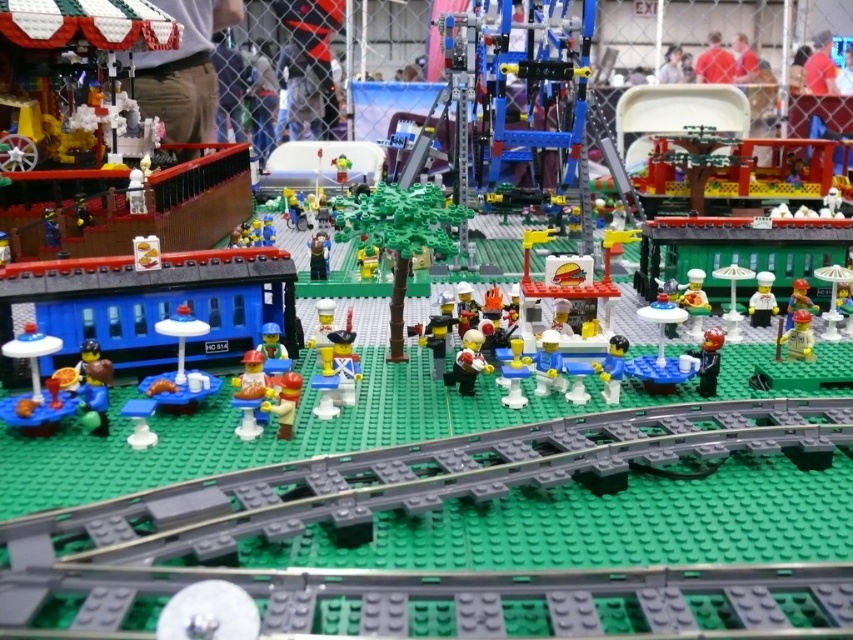
Can you confirm if white plastic table at center-left is thinner than yellow matte minifigure at right?

No, white plastic table at center-left is not thinner than yellow matte minifigure at right.

The width and height of the screenshot is (853, 640). In order to click on white plastic table at center-left in this screenshot , I will do pos(180,368).

This screenshot has width=853, height=640. I want to click on white plastic table at center-left, so click(x=180, y=368).

Who is lower down, white glossy chef hat at center or smooth plastic minifigure at center?

Positioned lower is smooth plastic minifigure at center.

Which is more to the right, white glossy chef hat at center or smooth plastic minifigure at center?

white glossy chef hat at center is more to the right.

Between point (691, 278) and point (262, 353), which one is positioned behind?

The point (691, 278) is behind.

The height and width of the screenshot is (640, 853). Identify the location of white glossy chef hat at center. (694, 301).

Based on the photo, can you confirm if translucent yellow minifigure at center is wider than smooth brown minifigure at center?

Correct, the width of translucent yellow minifigure at center exceeds that of smooth brown minifigure at center.

Based on the photo, does translucent yellow minifigure at center appear on the left side of smooth brown minifigure at center?

In fact, translucent yellow minifigure at center is to the right of smooth brown minifigure at center.

Does point (241, 401) come behind point (321, 266)?

That is False.

Identify the location of translucent yellow minifigure at center. This screenshot has height=640, width=853. pos(250,394).